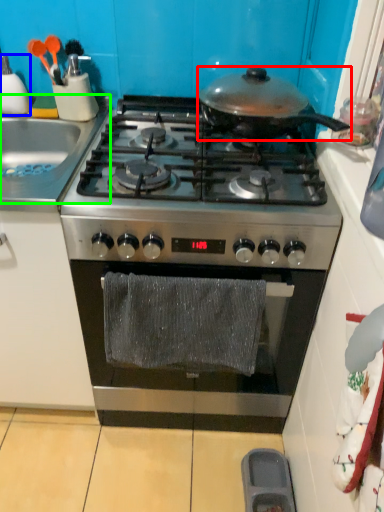
Question: Which is farther away from kitchen appliance (highlighted by a red box)? kitchen appliance (highlighted by a blue box) or sink (highlighted by a green box)?

Choices:
 (A) kitchen appliance
 (B) sink

Answer: (A)